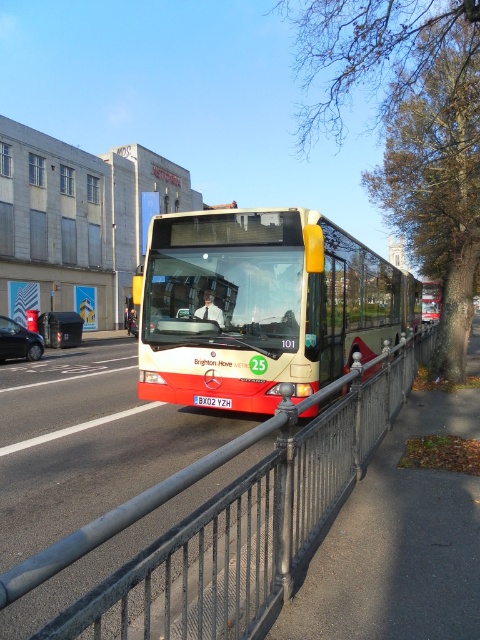
Question: Which of the following is the farthest from the observer?

Choices:
 (A) (12, 577)
 (B) (431, 317)
 (C) (265, 236)

Answer: (B)

Question: Which of the following is the closest to the observer?

Choices:
 (A) red matte bus at center
 (B) metallic bus stop at center

Answer: (B)

Question: In this image, where is metallic bus stop at center located relative to red matte bus at center?

Choices:
 (A) right
 (B) left

Answer: (B)

Question: Does metallic gray fence at center appear under metallic bus stop at center?

Choices:
 (A) yes
 (B) no

Answer: (A)

Question: Does metallic gray fence at center appear over metallic bus stop at center?

Choices:
 (A) no
 (B) yes

Answer: (A)

Question: Which object appears farthest from the camera in this image?

Choices:
 (A) shiny black car at left
 (B) metallic bus stop at center
 (C) metallic gray fence at center
 (D) red matte bus at center

Answer: (D)